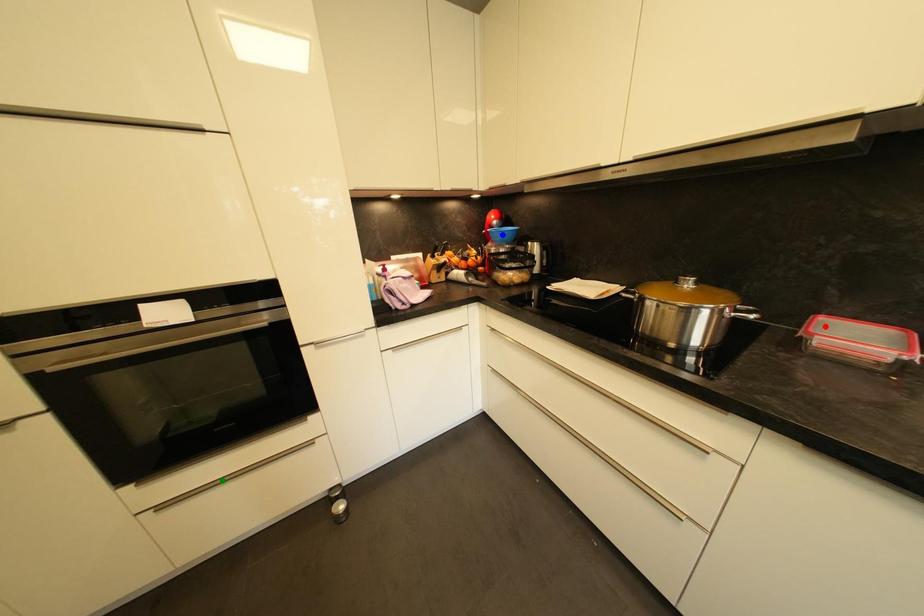
Order these from farthest to nearest:
- green point
- red point
- blue point

blue point, green point, red point